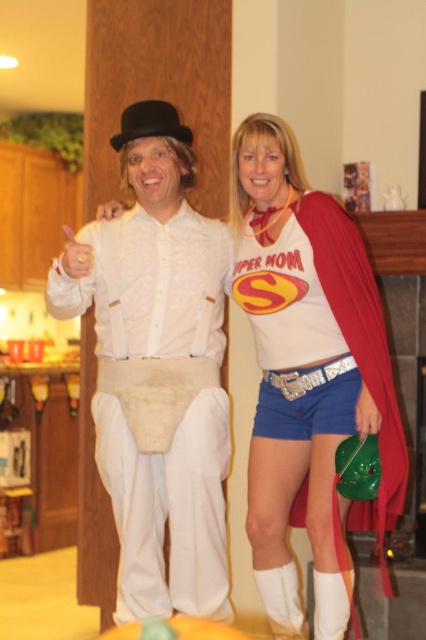
You are a costume designer trying to decide whether the white cotton pants at center can be paired with the matte red cape at center for a performance. Considering their widths, will the pants and cape overlap horizontally when worn?

The white cotton pants at center are wider than the matte red cape at center, so they will overlap horizontally when worn.

You are a costume designer trying to decide which item to adjust first. Since both the white cotton pants at center and the matte red cape at center are part of the same costume, which one should you prioritize if you need to make adjustments for a smaller size?

The matte red cape at center has a smaller size compared to the white cotton pants at center, so you should prioritize adjusting the matte red cape at center first to ensure it fits properly before adjusting the white cotton pants at center.